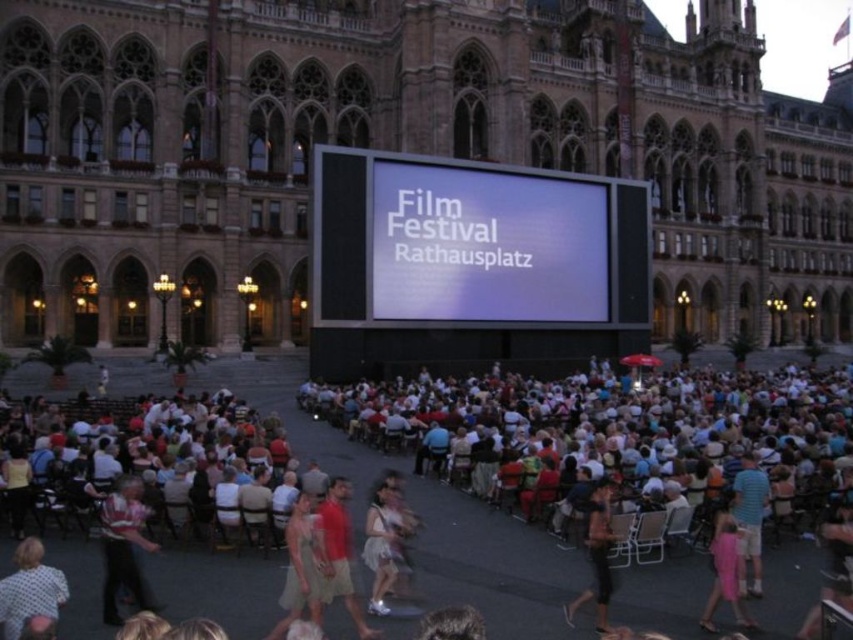
Question: Which of the following is the closest to the observer?

Choices:
 (A) (102, 532)
 (B) (366, 524)
 (C) (59, 602)
 (D) (579, 188)

Answer: (C)

Question: Is white glossy screen at center closer to camera compared to white dotted shirt at lower left?

Choices:
 (A) no
 (B) yes

Answer: (A)

Question: Where is matte black dress at center located in relation to white cotton dress at center in the image?

Choices:
 (A) above
 (B) below

Answer: (A)

Question: Estimate the real-world distances between objects in this image. Which object is closer to the matte black dress at center?

Choices:
 (A) white dotted shirt at lower left
 (B) white cotton dress at center
 (C) matte green shirt at center
 (D) pink fabric dress at lower right

Answer: (B)

Question: Can you confirm if matte black dress at center is smaller than matte green shirt at center?

Choices:
 (A) no
 (B) yes

Answer: (A)

Question: Which point is farther from the camera taking this photo?

Choices:
 (A) (720, 561)
 (B) (22, 560)
 (C) (753, 518)
 (D) (148, 547)

Answer: (C)